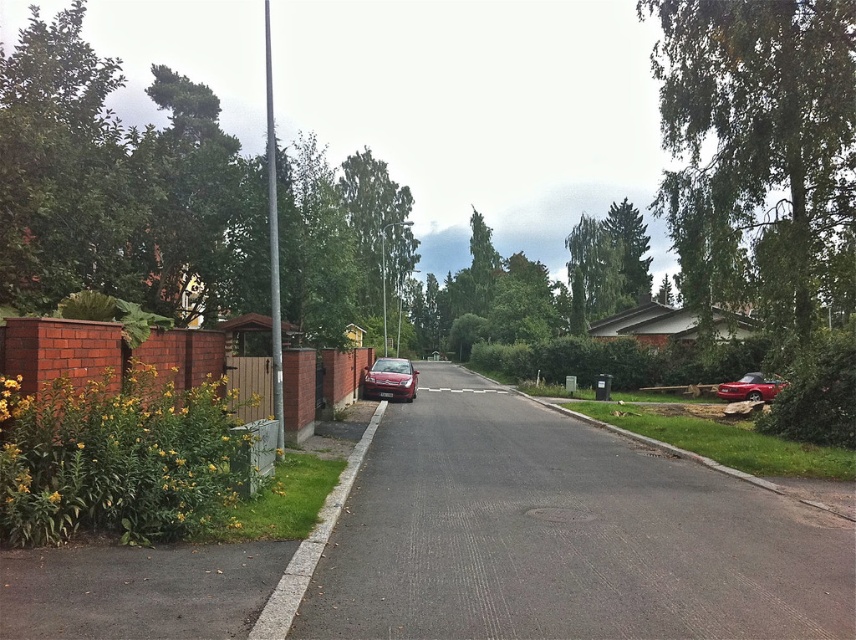
Question: Which point is farther to the camera?

Choices:
 (A) (736, 394)
 (B) (438, 365)

Answer: (B)

Question: Does green leafy tree at upper right have a lesser width compared to glossy metallic car at right?

Choices:
 (A) yes
 (B) no

Answer: (B)

Question: Does green leafy tree at upper right appear on the right side of satin silver sedan at center?

Choices:
 (A) no
 (B) yes

Answer: (B)

Question: Which object is positioned closest to the glossy metallic car at right?

Choices:
 (A) glossy red car at center
 (B) green leafy tree at upper right

Answer: (B)

Question: Which object is positioned closest to the green leafy tree at upper right?

Choices:
 (A) glossy red car at center
 (B) satin silver sedan at center

Answer: (A)

Question: Is green leafy tree at upper right thinner than satin silver sedan at center?

Choices:
 (A) no
 (B) yes

Answer: (A)